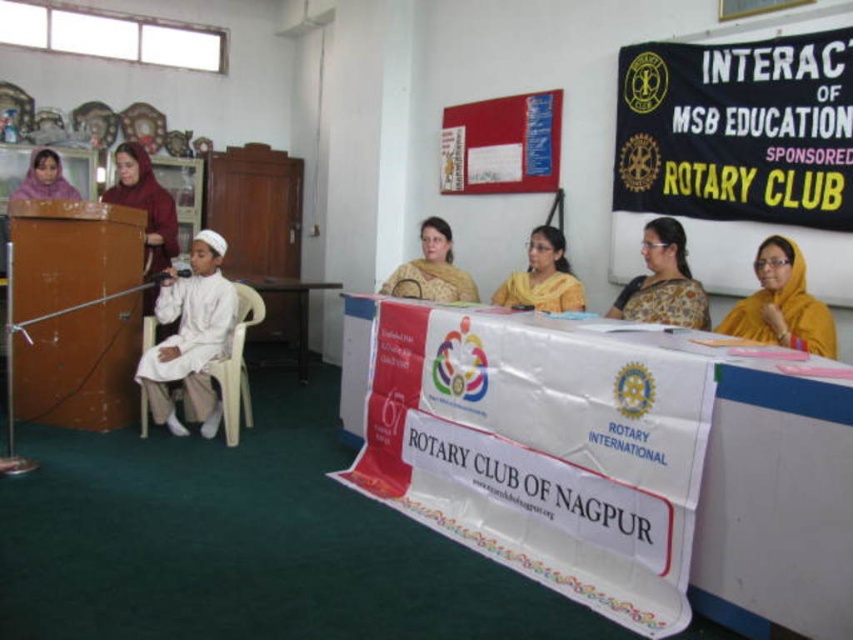
Between white cotton robe at center and yellow fabric at center, which one has less height?

yellow fabric at center

Who is positioned more to the right, white cotton robe at center or yellow fabric at center?

yellow fabric at center is more to the right.

What do you see at coordinates (190, 337) in the screenshot?
I see `white cotton robe at center` at bounding box center [190, 337].

Find the location of a particular element. Image resolution: width=853 pixels, height=640 pixels. white cotton robe at center is located at coordinates (190, 337).

From the picture: Between satin yellow sari at center and matte pink scarf at upper left, which one has less height?

matte pink scarf at upper left

Which is behind, point (682, 323) or point (38, 148)?

The point (38, 148) is more distant.

Who is more distant from viewer, (646, 268) or (71, 186)?

Positioned behind is point (71, 186).

The height and width of the screenshot is (640, 853). Find the location of `satin yellow sari at center`. satin yellow sari at center is located at coordinates (663, 282).

This screenshot has height=640, width=853. In order to click on yellow fabric at center in this screenshot , I will do [x=781, y=304].

How much distance is there between yellow fabric at center and golden fabric saree at center?

yellow fabric at center and golden fabric saree at center are 5.56 feet apart from each other.

At what (x,y) coordinates should I click in order to perform the action: click on yellow fabric at center. Please return your answer as a coordinate pair (x, y). This screenshot has width=853, height=640. Looking at the image, I should click on (781, 304).

Where is `yellow fabric at center`? yellow fabric at center is located at coordinates (781, 304).